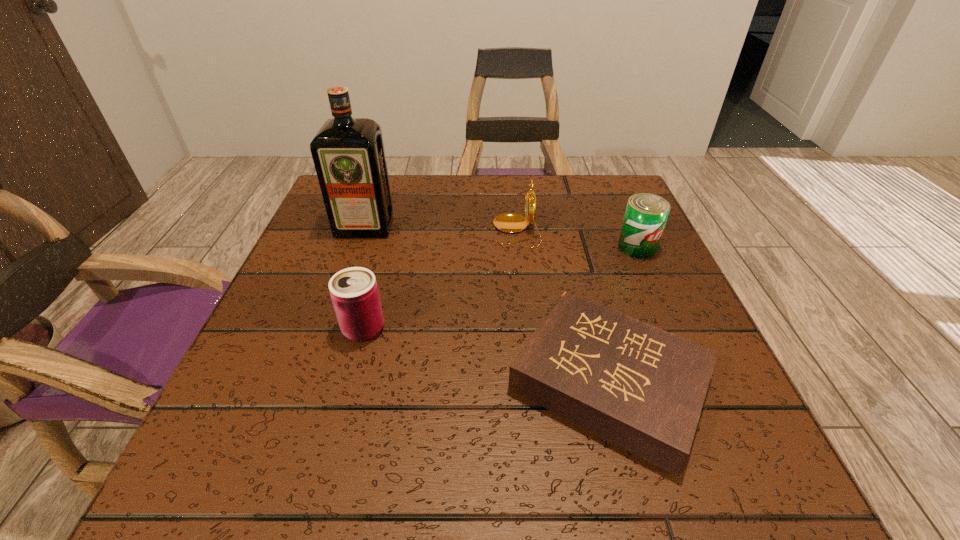
Identify the location of free spot between the left can and the pocket watch. (440, 280).

Where is `vacant area between the left can and the hardback book`? This screenshot has width=960, height=540. vacant area between the left can and the hardback book is located at coordinates (487, 355).

Locate an element on the screen. free space that is in between the nearer can and the hardback book is located at coordinates (487, 355).

I want to click on object that is the third closest one to the left can, so click(x=510, y=223).

The width and height of the screenshot is (960, 540). I want to click on object that stands as the second closest to the pocket watch, so click(x=642, y=388).

Where is `free space that satisfies the following two spatial constraints: 1. on the front label of the shortest object; 2. on the right side of the liquor`? free space that satisfies the following two spatial constraints: 1. on the front label of the shortest object; 2. on the right side of the liquor is located at coordinates (312, 381).

The image size is (960, 540). In order to click on free region that satisfies the following two spatial constraints: 1. on the face of the pocket watch; 2. on the back side of the right can in this screenshot , I will do [x=518, y=247].

The height and width of the screenshot is (540, 960). I want to click on vacant space that satisfies the following two spatial constraints: 1. on the face of the pocket watch; 2. on the left side of the hardback book, so [533, 381].

Locate an element on the screen. The image size is (960, 540). free space that satisfies the following two spatial constraints: 1. on the front label of the tallest object; 2. on the right side of the nearer can is located at coordinates (329, 328).

Identify the location of free space that satisfies the following two spatial constraints: 1. on the back side of the farther can; 2. on the left side of the shortest object. (574, 247).